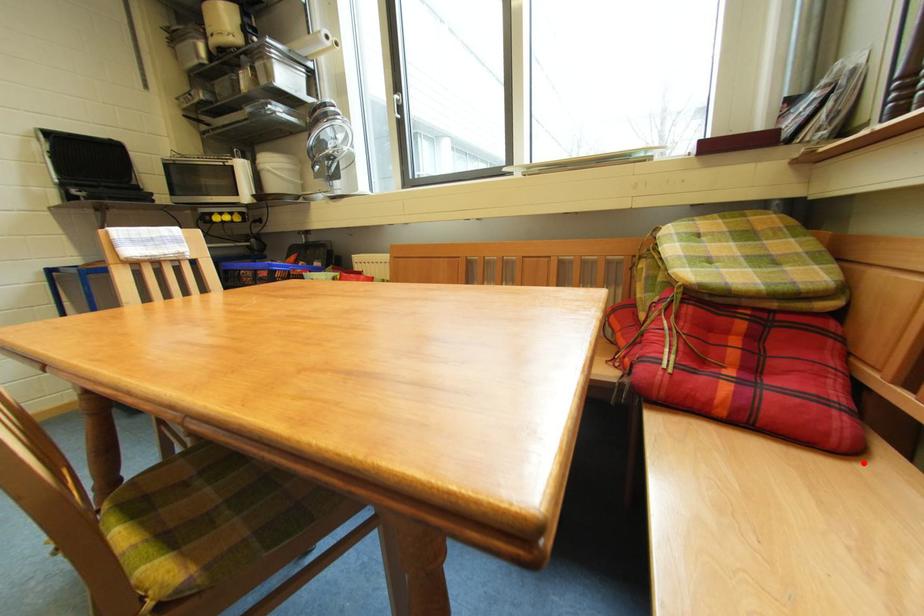
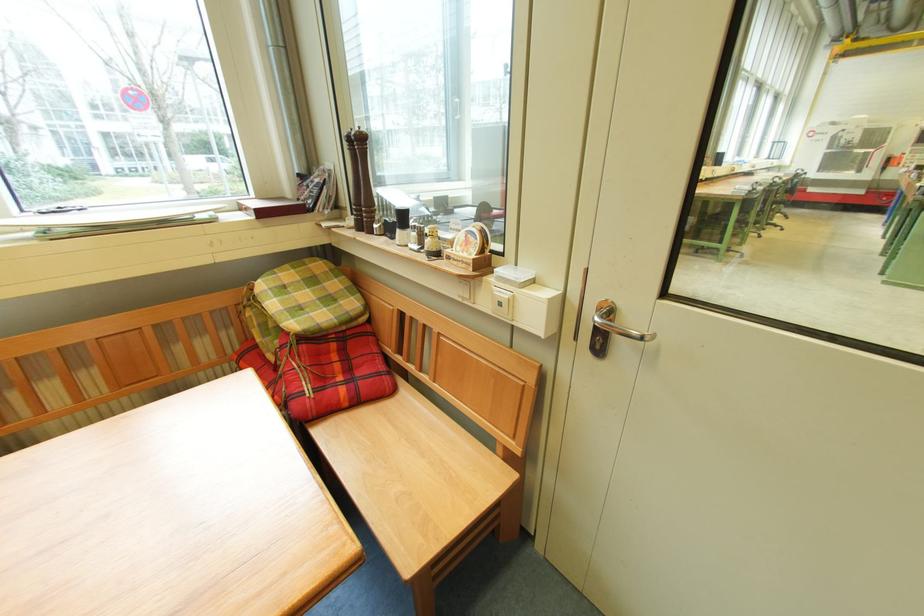
In the second image, find the point that corresponds to the highlighted location in the first image.

(403, 397)